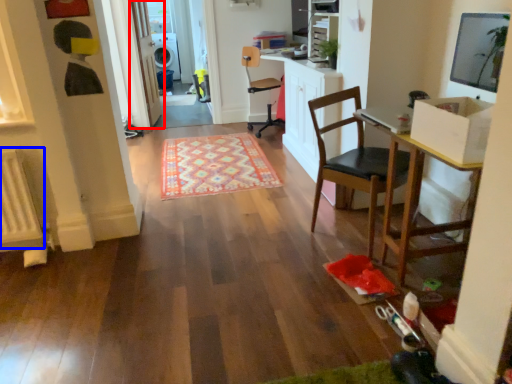
Question: Which object is closer to the camera taking this photo, door (highlighted by a red box) or radiator (highlighted by a blue box)?

Choices:
 (A) door
 (B) radiator

Answer: (B)